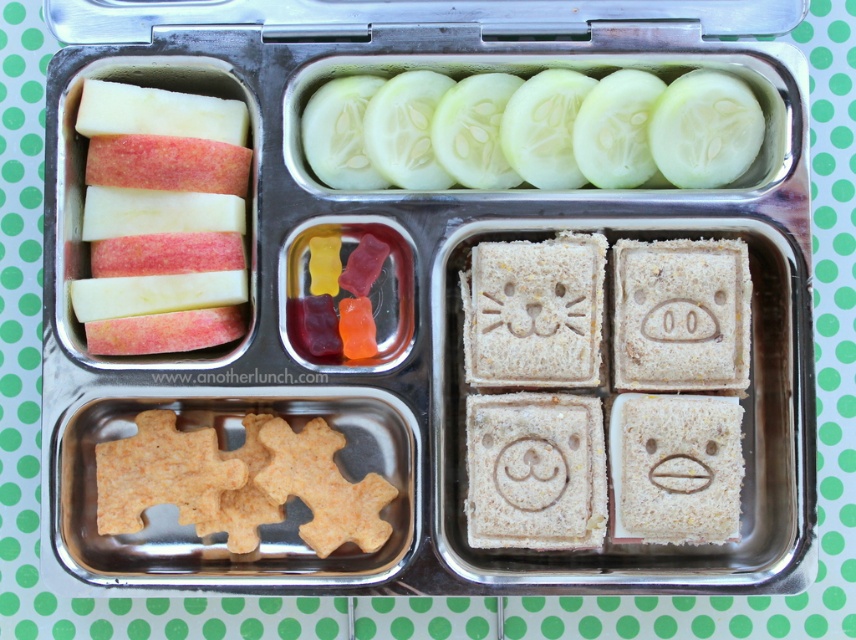
You are packing a bento box and need to place the green cucumber slices at upper center. Where should you place them relative to the other compartments?

The green cucumber slices at upper center should be placed in the top right compartment, as they are located at coordinates point (530, 131) which corresponds to the top right section of the bento box.

You are a child trying to reach for the green cucumber slices at upper center and the red matte apple at left in your bento box. Which one is closer to your hand if you are holding the bento box from the top?

The green cucumber slices at upper center is positioned over the red matte apple at left, so it is closer to your hand when holding the bento box from the top.

You are a child who wants to eat the gummy candies in the middle left compartment of the bento box. However, you accidentally touched the point at coordinate point (530, 131). What did you actually touch?

You touched the green cucumber slices at upper center because the point (530, 131) is located there.